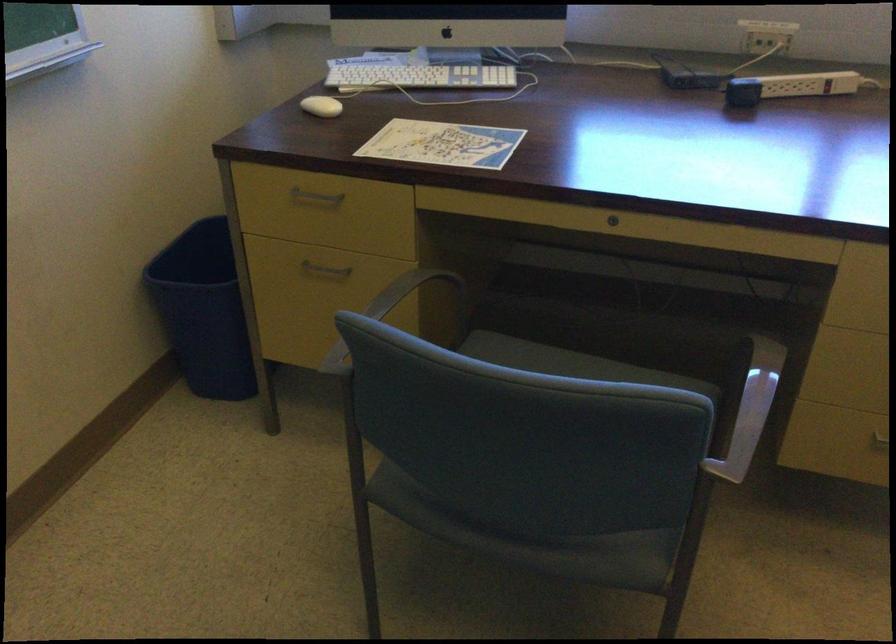
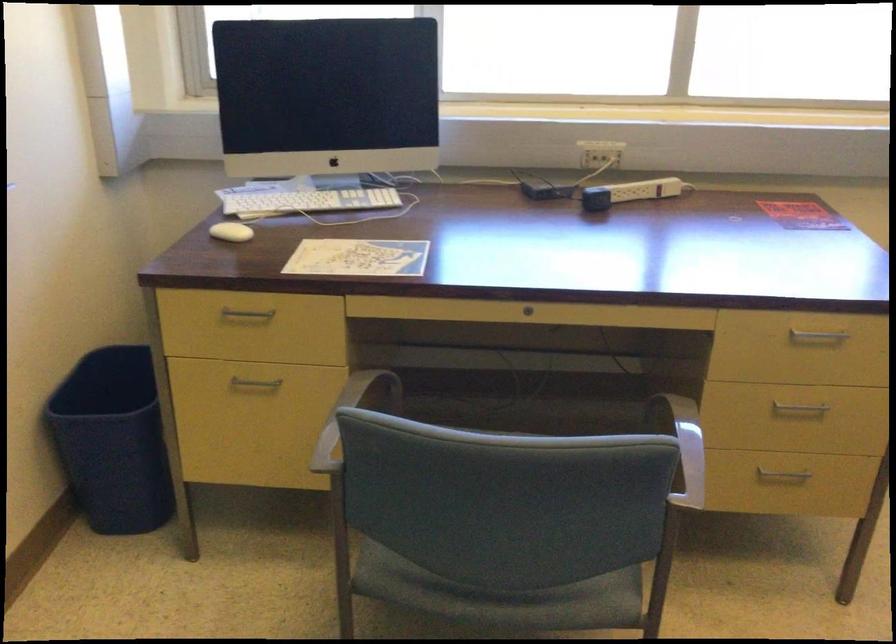
Question: The camera is either moving clockwise (left) or counter-clockwise (right) around the object. The first image is from the beginning of the video and the second image is from the end. Is the camera moving left or right when shooting the video?

Choices:
 (A) Left
 (B) Right

Answer: (A)